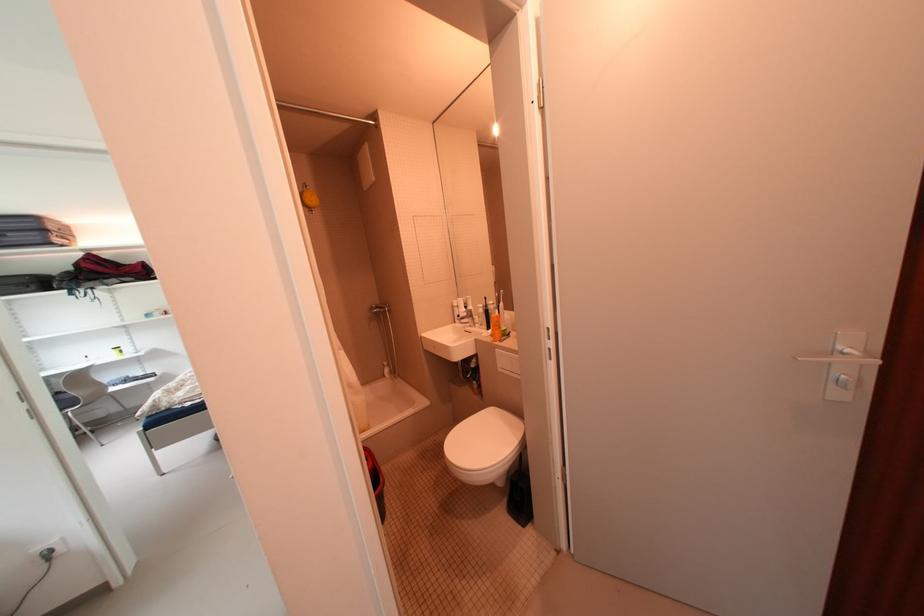
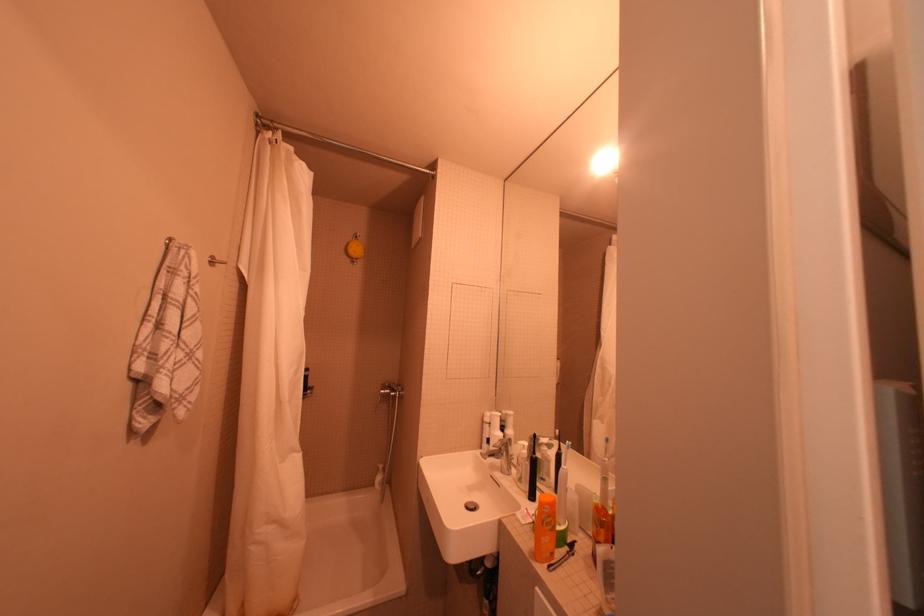
Locate, in the second image, the point that corresponds to pixel 505 345 in the first image.

(551, 570)